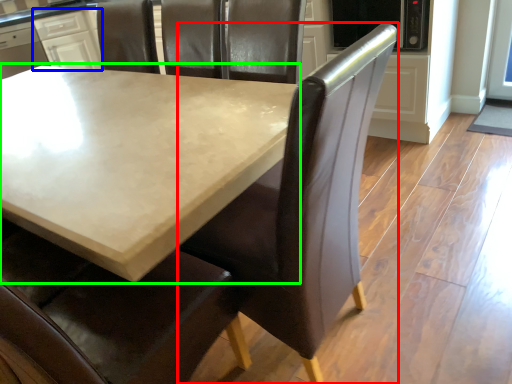
Question: Based on their relative distances, which object is farther from chair (highlighted by a red box)? Choose from cabinetry (highlighted by a blue box) and table (highlighted by a green box).

Choices:
 (A) cabinetry
 (B) table

Answer: (A)